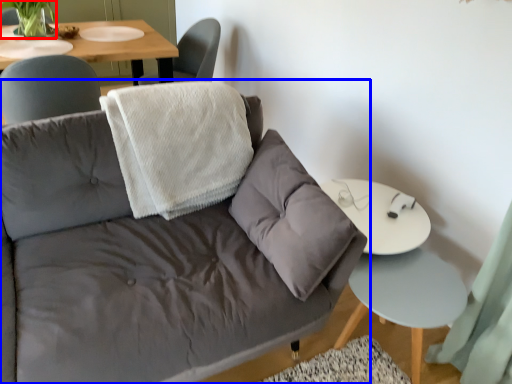
Question: Which object appears closest to the camera in this image, plant (highlighted by a red box) or studio couch (highlighted by a blue box)?

Choices:
 (A) plant
 (B) studio couch

Answer: (B)